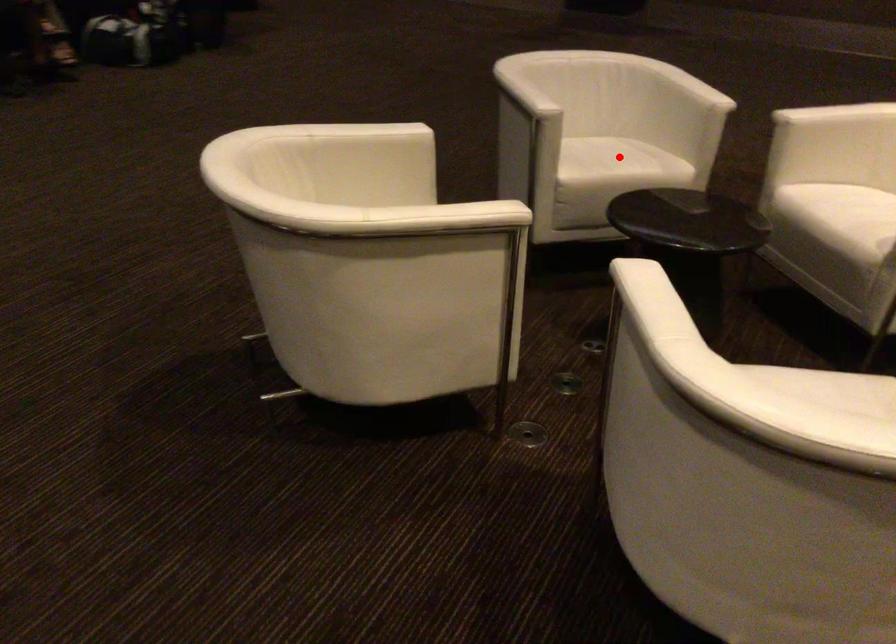
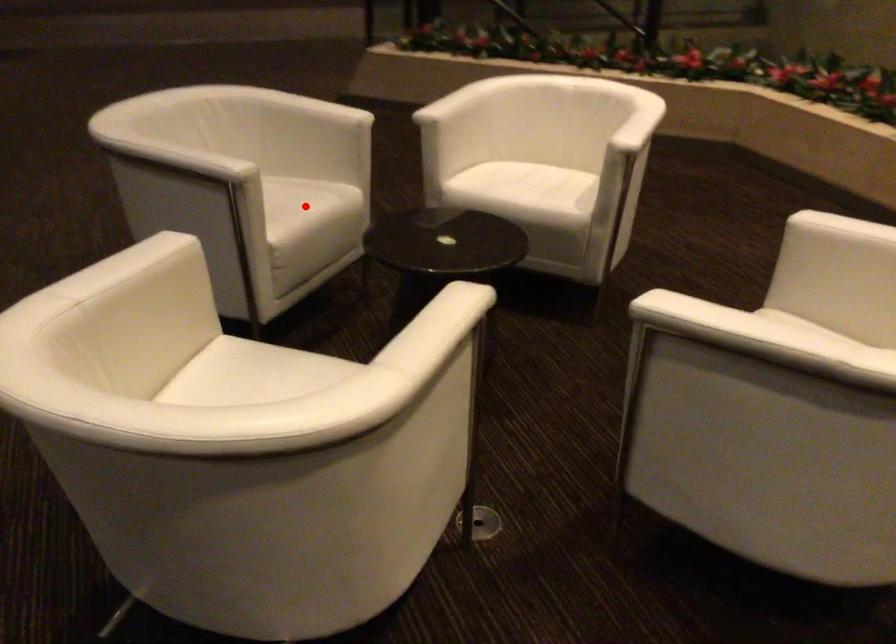
I am providing you with two images of the same scene from different viewpoints. A red point is marked on the first image and another point is marked on the second image. Does the point marked in image1 correspond to the same location as the one in image2?

Yes